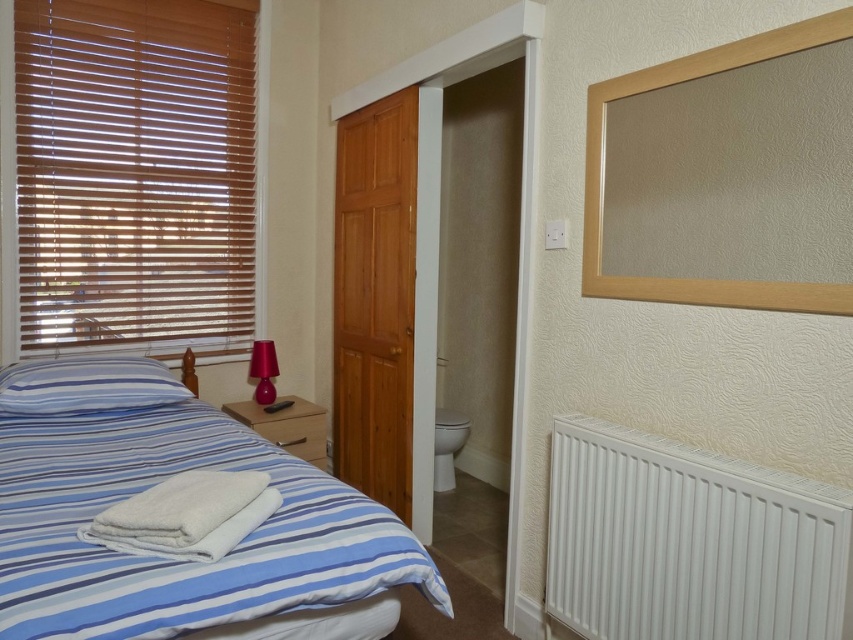
You are standing in the bedroom and need to place a new decorative item at the exact location where the white fluffy towel at lower left is currently positioned. What are the coordinates of that location?

The coordinates of the location where the white fluffy towel at lower left is positioned are at point (187, 515).

You are standing in the bedroom and want to reach the point at coordinates (x=714, y=570). If you are 1.6 meters tall, will you be able to touch the ceiling at that point?

The distance of point (x=714, y=570) from viewer is 1.52 meters. Since the height of the ceiling isn not provided, we can not determine if you can touch it.

Based on the photo, you are organizing the bed and need to place both the white fluffy towel at lower left and the blue striped pillow at lower left. Which item has a larger width?

The blue striped pillow at lower left has a larger width than the white fluffy towel at lower left.